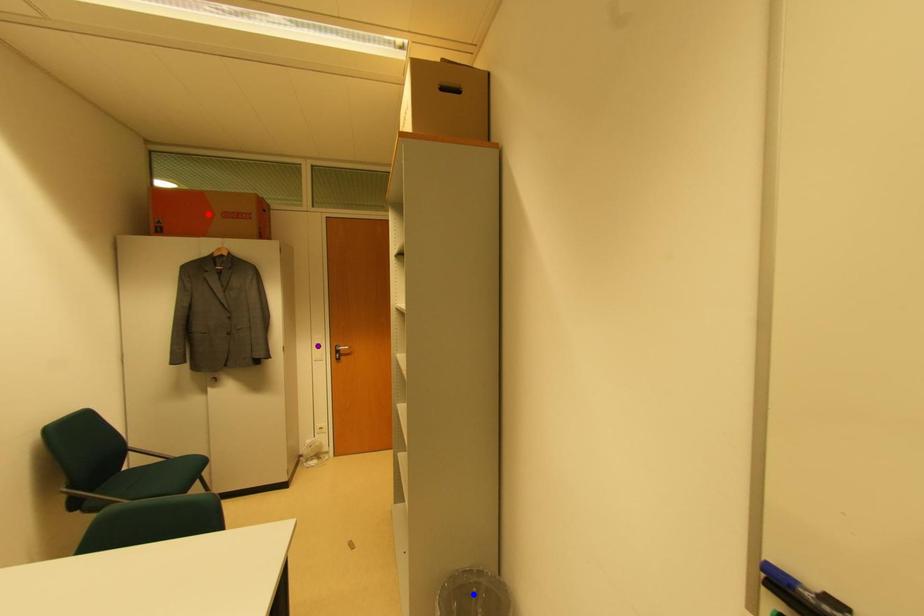
Order these from farthest to nearest:
purple point | red point | blue point

purple point, red point, blue point